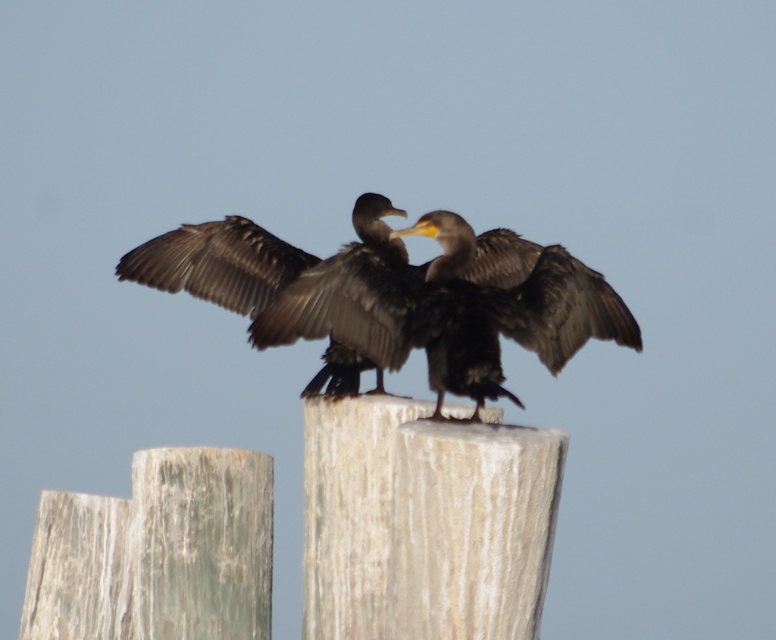
You are a birdwatcher trying to determine the relative sizes of the objects in the image. Based on the scene, can you tell if the white textured post at center is wider than the dark brown feathers at center?

The white textured post at center might be wider than dark brown feathers at center according to the description.

You are a bird with a wingspan of 1.8 meters. You want to fly from your current position to land on the white textured post at center. There is a dark brown feathers at center nearby. Can you reach the post without flapping your wings more than twice?

The distance between the white textured post at center and dark brown feathers at center is 2.60 meters. Since your wingspan is 1.8 meters, which is shorter than the distance, you would need to flap your wings more than twice to cover the gap. Therefore, you cannot reach the post without exceeding the flap limit.

You are a birdwatcher observing the two birds in the scene. You notice that one object is taller than the other. Which object is taller between the dark brown feathers at center and the brown feathered bird at center?

The dark brown feathers at center is taller than the brown feathered bird at center.